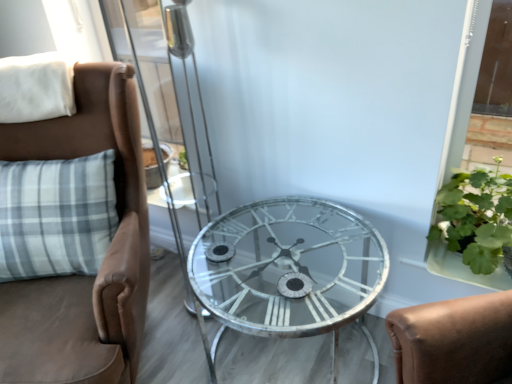
Question: Does green leafy plant at right appear on the right side of white soft pillow at upper left?

Choices:
 (A) no
 (B) yes

Answer: (B)

Question: From the image's perspective, is green leafy plant at right on top of white soft pillow at upper left?

Choices:
 (A) no
 (B) yes

Answer: (A)

Question: From the image's perspective, is green leafy plant at right beneath white soft pillow at upper left?

Choices:
 (A) no
 (B) yes

Answer: (B)

Question: Is green leafy plant at right thinner than white soft pillow at upper left?

Choices:
 (A) no
 (B) yes

Answer: (A)

Question: Can you confirm if green leafy plant at right is smaller than white soft pillow at upper left?

Choices:
 (A) yes
 (B) no

Answer: (B)

Question: Is white soft pillow at upper left taller or shorter than transparent glass screen door at center?

Choices:
 (A) short
 (B) tall

Answer: (A)

Question: From the image's perspective, relative to transparent glass screen door at center, is white soft pillow at upper left above or below?

Choices:
 (A) above
 (B) below

Answer: (A)

Question: Is white soft pillow at upper left wider or thinner than transparent glass screen door at center?

Choices:
 (A) thin
 (B) wide

Answer: (A)

Question: From a real-world perspective, is white soft pillow at upper left physically located above or below transparent glass screen door at center?

Choices:
 (A) above
 (B) below

Answer: (A)

Question: Does point (190, 299) appear closer or farther from the camera than point (470, 238)?

Choices:
 (A) farther
 (B) closer

Answer: (A)

Question: Would you say transparent glass screen door at center is to the left or to the right of green leafy plant at right in the picture?

Choices:
 (A) left
 (B) right

Answer: (A)

Question: From the image's perspective, is transparent glass screen door at center above or below green leafy plant at right?

Choices:
 (A) below
 (B) above

Answer: (B)

Question: Do you think transparent glass screen door at center is within green leafy plant at right, or outside of it?

Choices:
 (A) inside
 (B) outside

Answer: (B)

Question: From a real-world perspective, is brown leather chair at left positioned above or below transparent glass screen door at center?

Choices:
 (A) below
 (B) above

Answer: (A)

Question: Based on their sizes in the image, would you say brown leather chair at left is bigger or smaller than transparent glass screen door at center?

Choices:
 (A) big
 (B) small

Answer: (A)